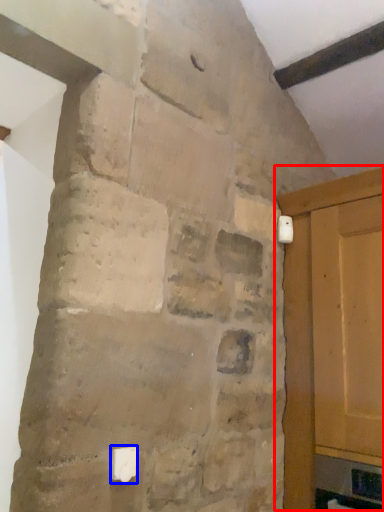
Question: Which of the following is the closest to the observer, door (highlighted by a red box) or light switch (highlighted by a blue box)?

Choices:
 (A) door
 (B) light switch

Answer: (B)